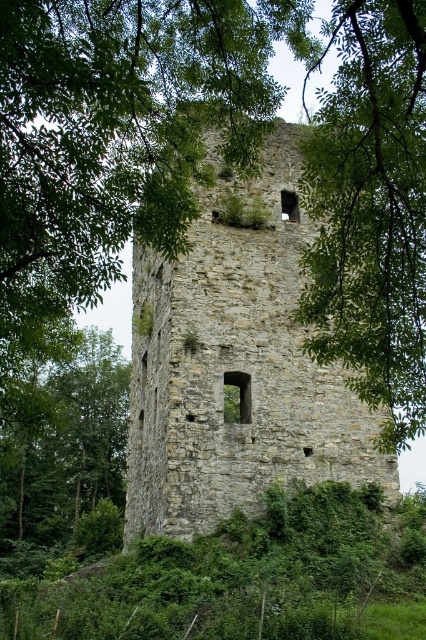
Can you confirm if stone tower at center is positioned to the left of green leafy tree at left?

In fact, stone tower at center is to the right of green leafy tree at left.

Can you confirm if stone tower at center is positioned to the right of green leafy tree at left?

Yes, stone tower at center is to the right of green leafy tree at left.

Which is in front, point (233, 241) or point (23, 467)?

Point (233, 241)

The image size is (426, 640). Identify the location of stone tower at center. (236, 365).